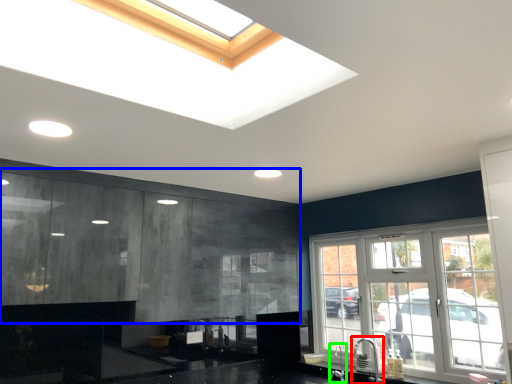
Question: Considering the real-world distances, which object is farthest from faucet (highlighted by a red box)? cabinetry (highlighted by a blue box) or faucet (highlighted by a green box)?

Choices:
 (A) cabinetry
 (B) faucet

Answer: (A)